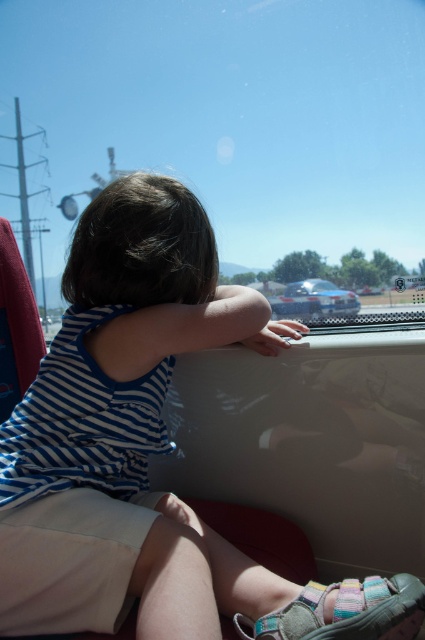
Does multicolored fabric sandal at lower center have a greater height compared to glossy metallic car at center?

In fact, multicolored fabric sandal at lower center may be shorter than glossy metallic car at center.

Describe the element at coordinates (345, 611) in the screenshot. I see `multicolored fabric sandal at lower center` at that location.

Identify the location of multicolored fabric sandal at lower center. Image resolution: width=425 pixels, height=640 pixels. (345, 611).

I want to click on multicolored fabric sandal at lower center, so click(345, 611).

Is blue striped tank top at center to the right of glossy metallic car at center from the viewer's perspective?

No, blue striped tank top at center is not to the right of glossy metallic car at center.

Is blue striped tank top at center thinner than glossy metallic car at center?

Yes.

Where is `blue striped tank top at center`? The width and height of the screenshot is (425, 640). blue striped tank top at center is located at coordinates (141, 445).

Can you confirm if blue striped tank top at center is smaller than multicolored fabric sandal at lower center?

Incorrect, blue striped tank top at center is not smaller in size than multicolored fabric sandal at lower center.

Does blue striped tank top at center lie in front of multicolored fabric sandal at lower center?

Yes, blue striped tank top at center is closer to the viewer.

What do you see at coordinates (141, 445) in the screenshot?
I see `blue striped tank top at center` at bounding box center [141, 445].

Find the location of `blue striped tank top at center`. blue striped tank top at center is located at coordinates (141, 445).